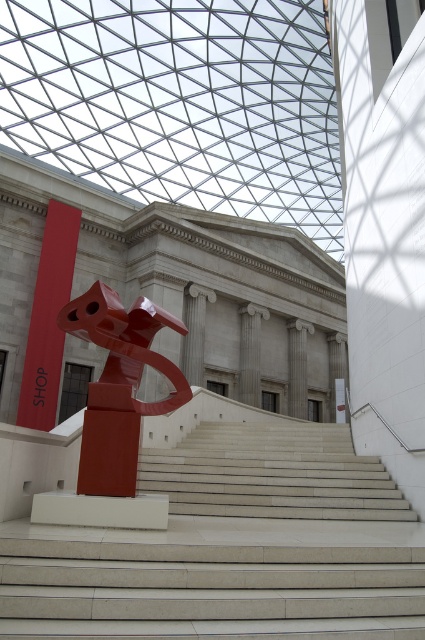
You are an interior designer planning to place a new decorative element in the space. You have two options to choose from. One is a large sculpture that will take up the same amount of space as the white marble stairs at center. The other is a smaller sculpture that will take up the same amount of space as the matte red sign at left. Which option would you choose if you want the sculpture to be more prominent in the room?

The white marble stairs at center occupies less space than the matte red sign at left. Therefore, choosing the large sculpture with the same space as the white marble stairs at center would result in a smaller sculpture, making it less prominent. To have a more prominent sculpture, you should choose the smaller sculpture that takes up the same space as the matte red sign at left, which is larger in size.

You are standing at the entrance of the building and want to reach the grandiose building facade in the background. Which direction should you walk relative to the white marble stairs at center?

You should walk towards the white marble stairs at center since the grandiose building facade is located behind them.